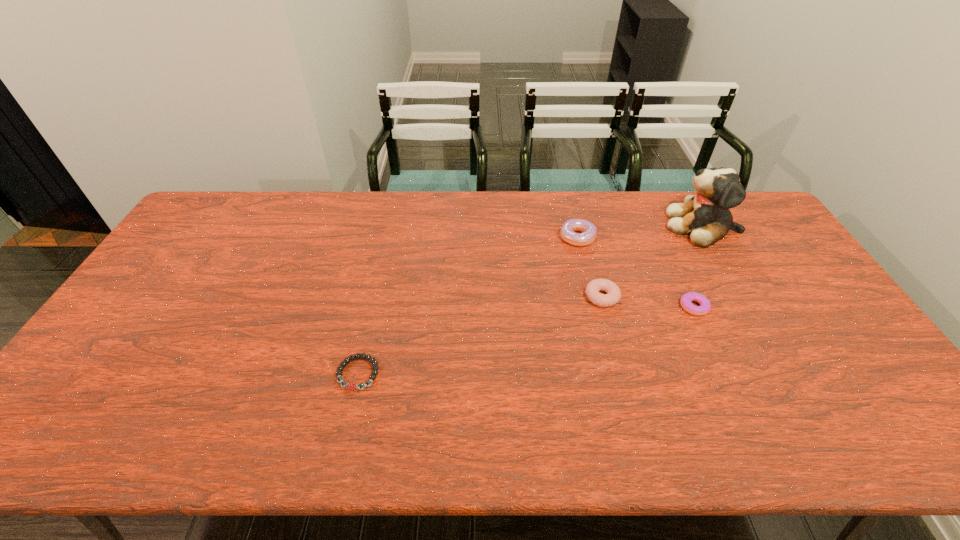
Locate an element on the screen. The image size is (960, 540). blank space located 0.090m at the face of the puppy is located at coordinates (638, 226).

Image resolution: width=960 pixels, height=540 pixels. I want to click on vacant space located 0.390m on the left of the fourth shortest object, so click(444, 237).

Where is `free region located on the right of the second shortest doughnut`? The image size is (960, 540). free region located on the right of the second shortest doughnut is located at coordinates (718, 297).

The width and height of the screenshot is (960, 540). I want to click on free space located 0.140m on the back of the shortest doughnut, so click(x=674, y=264).

I want to click on free region located 0.210m on the back of the nearest object, so click(375, 296).

Find the location of a particular element. This screenshot has width=960, height=540. puppy at the far edge is located at coordinates (706, 217).

Locate an element on the screen. Image resolution: width=960 pixels, height=540 pixels. doughnut located at the far edge is located at coordinates (588, 229).

Locate an element on the screen. object present at the right edge is located at coordinates (706, 217).

Locate an element on the screen. The width and height of the screenshot is (960, 540). object situated at the far right corner is located at coordinates (706, 217).

What are the coordinates of `vacant region at the far edge of the desktop` in the screenshot? It's located at (483, 221).